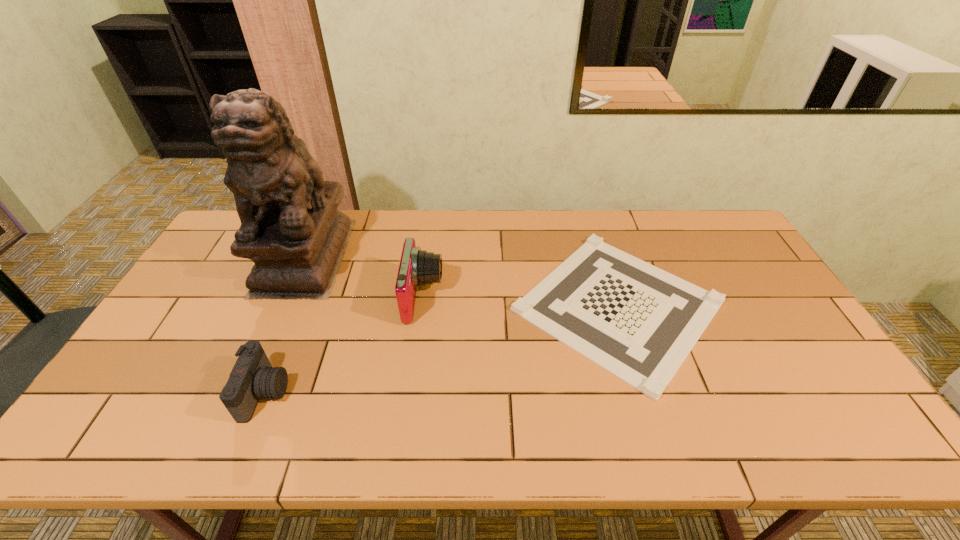
Locate an element on the screen. free spot between the rightmost object and the second shortest object is located at coordinates (442, 349).

You are a GUI agent. You are given a task and a screenshot of the screen. Output one action in this format:
    pyautogui.click(x=<x>, y=<y>)
    Task: Click on the vacant point located between the tallest object and the checkerboard
    The width and height of the screenshot is (960, 540).
    Given the screenshot: What is the action you would take?
    tap(462, 281)

The image size is (960, 540). I want to click on vacant area between the nearer camera and the sculpture, so click(x=285, y=325).

Locate an element on the screen. Image resolution: width=960 pixels, height=540 pixels. empty space between the taller camera and the sculpture is located at coordinates click(x=364, y=277).

Identify the location of free area in between the second tallest object and the nearer camera. The width and height of the screenshot is (960, 540). (344, 345).

The height and width of the screenshot is (540, 960). In order to click on vacant area between the shortest object and the second shortest object in this screenshot , I will do `click(442, 349)`.

The width and height of the screenshot is (960, 540). In order to click on unoccupied area between the second tallest object and the sculpture in this screenshot , I will do `click(364, 277)`.

The height and width of the screenshot is (540, 960). I want to click on vacant area between the right camera and the third tallest object, so click(x=344, y=345).

You are a GUI agent. You are given a task and a screenshot of the screen. Output one action in this format:
    pyautogui.click(x=<x>, y=<y>)
    Task: Click on the object that is the closest to the left camera
    This screenshot has width=960, height=540.
    Given the screenshot: What is the action you would take?
    pyautogui.click(x=291, y=229)

Identify which object is located as the second nearest to the shorter camera. Please provide its 2D coordinates. Your answer should be formatted as a tuple, i.e. [(x, y)], where the tuple contains the x and y coordinates of a point satisfying the conditions above.

[(417, 267)]